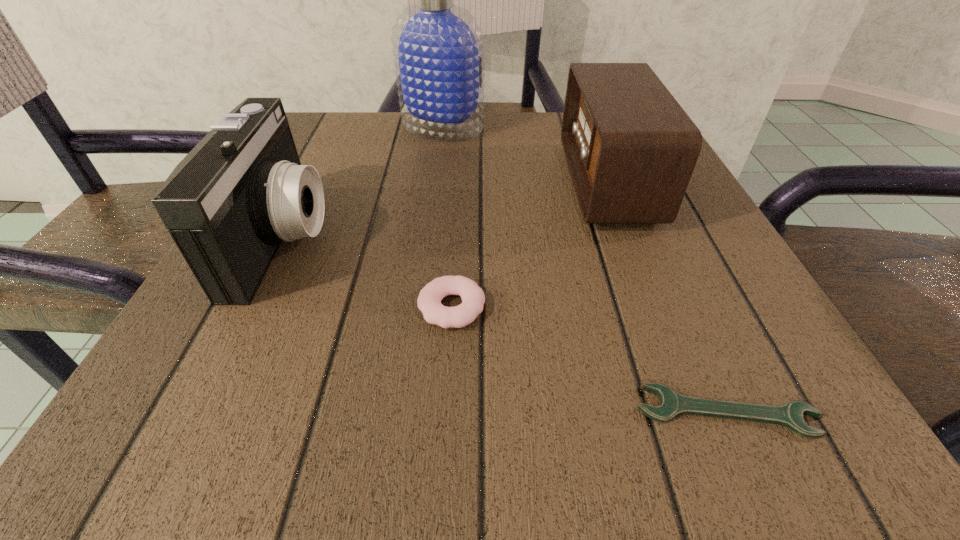
At what (x,y) coordinates should I click in order to perform the action: click on object present at the far right corner. Please return your answer as a coordinate pair (x, y). This screenshot has height=540, width=960. Looking at the image, I should click on (631, 149).

Find the location of a particular element. object that is at the near right corner is located at coordinates (672, 404).

What are the coordinates of `vacant area at the far edge` in the screenshot? It's located at (446, 152).

You are a GUI agent. You are given a task and a screenshot of the screen. Output one action in this format:
    pyautogui.click(x=<x>, y=<y>)
    Task: Click on the free space at the left edge
    The width and height of the screenshot is (960, 540).
    Given the screenshot: What is the action you would take?
    343,215

The height and width of the screenshot is (540, 960). In order to click on vacant space at the right edge of the desktop in this screenshot , I will do `click(689, 231)`.

Identify the location of vacant space at the far left corner. This screenshot has width=960, height=540. (346, 159).

At what (x,y) coordinates should I click in order to perform the action: click on blank region between the radio receiver and the farthest object. Please return your answer as a coordinate pair (x, y). Looking at the image, I should click on (525, 155).

Identify the location of unoccupied position between the radio receiver and the doughnut. click(x=529, y=245).

Image resolution: width=960 pixels, height=540 pixels. What are the coordinates of `unoccupied position between the radio receiver and the tallest object` in the screenshot? It's located at (525, 155).

You are a GUI agent. You are given a task and a screenshot of the screen. Output one action in this format:
    pyautogui.click(x=<x>, y=<y>)
    Task: Click on the free spot between the wrench and the doughnut
    This screenshot has height=540, width=960.
    Given the screenshot: What is the action you would take?
    pyautogui.click(x=589, y=359)